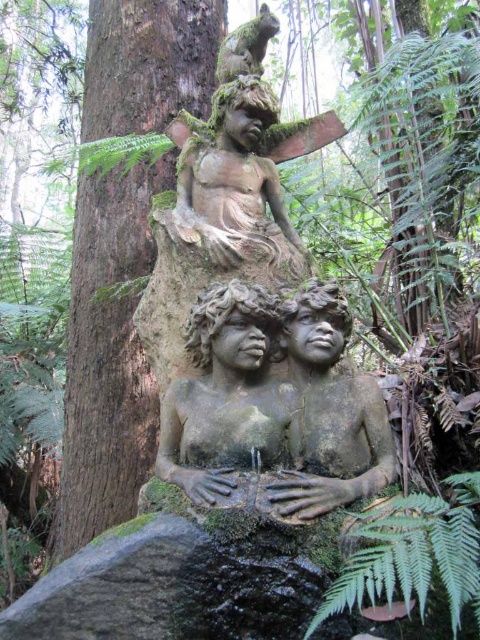
Question: Does brown rough tree trunk at center have a larger size compared to brown stone statue at center?

Choices:
 (A) no
 (B) yes

Answer: (B)

Question: Estimate the real-world distances between objects in this image. Which object is closer to the green leafy fern at lower center?

Choices:
 (A) brown stone statue at center
 (B) brown rough tree trunk at center
 (C) stone textured statue at center
 (D) stone statue at upper center

Answer: (A)

Question: Is brown stone statue at center bigger than green leafy fern at lower center?

Choices:
 (A) no
 (B) yes

Answer: (A)

Question: Which is farther from the stone statue at upper center?

Choices:
 (A) brown rough tree trunk at center
 (B) stone textured statue at center

Answer: (A)

Question: Is stone textured statue at center thinner than stone statue at upper center?

Choices:
 (A) no
 (B) yes

Answer: (B)

Question: Which of the following is the farthest from the observer?

Choices:
 (A) green leafy fern at lower center
 (B) brown rough tree trunk at center
 (C) stone statue at upper center

Answer: (B)